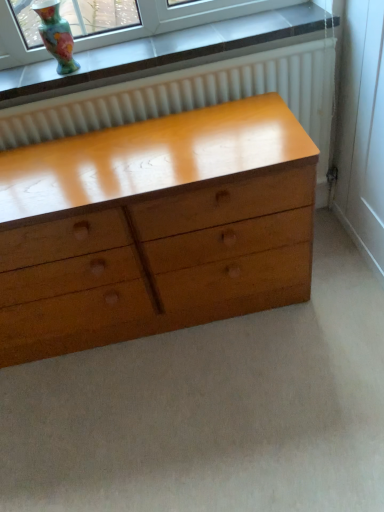
Locate an element on the screen. glossy wood chest of drawers at center is located at coordinates (151, 226).

Measure the distance between glossy wood chest of drawers at center and camera.

A distance of 3.81 feet exists between glossy wood chest of drawers at center and camera.

What do you see at coordinates (151, 226) in the screenshot?
I see `glossy wood chest of drawers at center` at bounding box center [151, 226].

The height and width of the screenshot is (512, 384). What do you see at coordinates (56, 35) in the screenshot?
I see `multicolored glass vase at upper left` at bounding box center [56, 35].

The height and width of the screenshot is (512, 384). In order to click on multicolored glass vase at upper left in this screenshot , I will do `click(56, 35)`.

What is the approximate height of multicolored glass vase at upper left?

It is 8.16 inches.

You are a GUI agent. You are given a task and a screenshot of the screen. Output one action in this format:
    pyautogui.click(x=<x>, y=<y>)
    Task: Click on the glossy wood chest of drawers at center
    The image size is (384, 512).
    Given the screenshot: What is the action you would take?
    pyautogui.click(x=151, y=226)

Can you confirm if glossy wood chest of drawers at center is positioned to the left of multicolored glass vase at upper left?

Incorrect, glossy wood chest of drawers at center is not on the left side of multicolored glass vase at upper left.

Considering their positions, is glossy wood chest of drawers at center located in front of or behind multicolored glass vase at upper left?

Visually, glossy wood chest of drawers at center is located in front of multicolored glass vase at upper left.

Which is in front, point (8, 336) or point (58, 68)?

Point (58, 68)

From the image's perspective, between glossy wood chest of drawers at center and multicolored glass vase at upper left, which one is located above?

From the image's view, multicolored glass vase at upper left is above.

From a real-world perspective, is glossy wood chest of drawers at center beneath multicolored glass vase at upper left?

Yes, from a real-world perspective, glossy wood chest of drawers at center is under multicolored glass vase at upper left.

In the scene shown: Considering the sizes of objects glossy wood chest of drawers at center and multicolored glass vase at upper left in the image provided, who is wider, glossy wood chest of drawers at center or multicolored glass vase at upper left?

glossy wood chest of drawers at center.

Considering the sizes of objects glossy wood chest of drawers at center and multicolored glass vase at upper left in the image provided, who is shorter, glossy wood chest of drawers at center or multicolored glass vase at upper left?

With less height is multicolored glass vase at upper left.

Does glossy wood chest of drawers at center have a larger size compared to multicolored glass vase at upper left?

Indeed, glossy wood chest of drawers at center has a larger size compared to multicolored glass vase at upper left.

Is glossy wood chest of drawers at center spatially inside multicolored glass vase at upper left, or outside of it?

glossy wood chest of drawers at center is not enclosed by multicolored glass vase at upper left.

Are glossy wood chest of drawers at center and multicolored glass vase at upper left far apart?

They are positioned close to each other.

Does glossy wood chest of drawers at center turn towards multicolored glass vase at upper left?

No, glossy wood chest of drawers at center does not turn towards multicolored glass vase at upper left.

How many degrees apart are the facing directions of glossy wood chest of drawers at center and multicolored glass vase at upper left?

glossy wood chest of drawers at center and multicolored glass vase at upper left are facing 3.07 degrees away from each other.

How far apart are glossy wood chest of drawers at center and multicolored glass vase at upper left?

They are 63.27 centimeters apart.

Locate an element on the screen. This screenshot has width=384, height=512. chest of drawers on the right of multicolored glass vase at upper left is located at coordinates (151, 226).

Can you confirm if multicolored glass vase at upper left is positioned to the left of glossy wood chest of drawers at center?

Correct, you'll find multicolored glass vase at upper left to the left of glossy wood chest of drawers at center.

Relative to glossy wood chest of drawers at center, is multicolored glass vase at upper left in front or behind?

Visually, multicolored glass vase at upper left is located behind glossy wood chest of drawers at center.

Does point (61, 61) come in front of point (174, 272)?

No, it is not.

From the image's perspective, who appears lower, multicolored glass vase at upper left or glossy wood chest of drawers at center?

glossy wood chest of drawers at center appears lower in the image.

From a real-world perspective, is multicolored glass vase at upper left physically above glossy wood chest of drawers at center?

Yes, from a real-world perspective, multicolored glass vase at upper left is above glossy wood chest of drawers at center.

Is multicolored glass vase at upper left thinner than glossy wood chest of drawers at center?

Correct, the width of multicolored glass vase at upper left is less than that of glossy wood chest of drawers at center.

Can you confirm if multicolored glass vase at upper left is shorter than glossy wood chest of drawers at center?

Correct, multicolored glass vase at upper left is not as tall as glossy wood chest of drawers at center.

Is multicolored glass vase at upper left smaller than glossy wood chest of drawers at center?

Yes, multicolored glass vase at upper left is smaller than glossy wood chest of drawers at center.

Could glossy wood chest of drawers at center be considered to be inside multicolored glass vase at upper left?

No.

Are multicolored glass vase at upper left and glossy wood chest of drawers at center located far from each other?

No, there isn't a large distance between multicolored glass vase at upper left and glossy wood chest of drawers at center.

Is multicolored glass vase at upper left facing away from glossy wood chest of drawers at center?

No, multicolored glass vase at upper left is not facing away from glossy wood chest of drawers at center.

Can you tell me how much multicolored glass vase at upper left and glossy wood chest of drawers at center differ in facing direction?

3.07 degrees.

The height and width of the screenshot is (512, 384). In order to click on vase that is above the glossy wood chest of drawers at center (from the image's perspective) in this screenshot , I will do `click(56, 35)`.

Locate an element on the screen. The height and width of the screenshot is (512, 384). chest of drawers in front of the multicolored glass vase at upper left is located at coordinates (151, 226).

This screenshot has width=384, height=512. What are the coordinates of `the chest of drawers located below the multicolored glass vase at upper left (from the image's perspective)` in the screenshot? It's located at (151, 226).